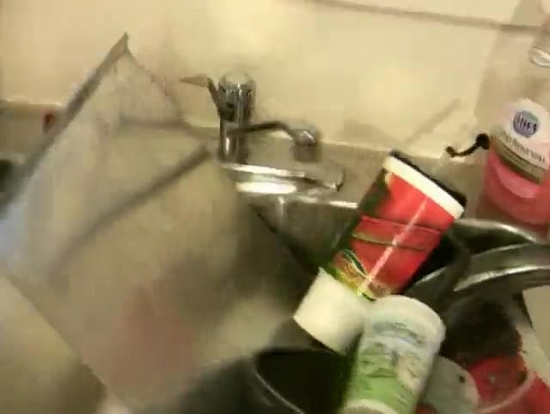
You are a GUI agent. You are given a task and a screenshot of the screen. Output one action in this format:
    pyautogui.click(x=<x>, y=<y>)
    Task: Click on the tall plastic cup
    The height and width of the screenshot is (414, 550).
    Given the screenshot: What is the action you would take?
    pyautogui.click(x=390, y=206)